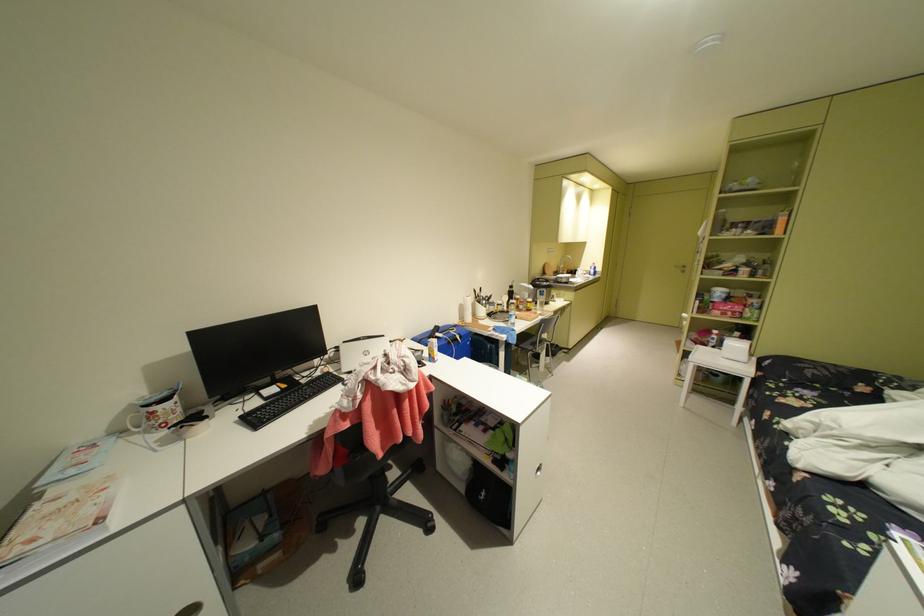
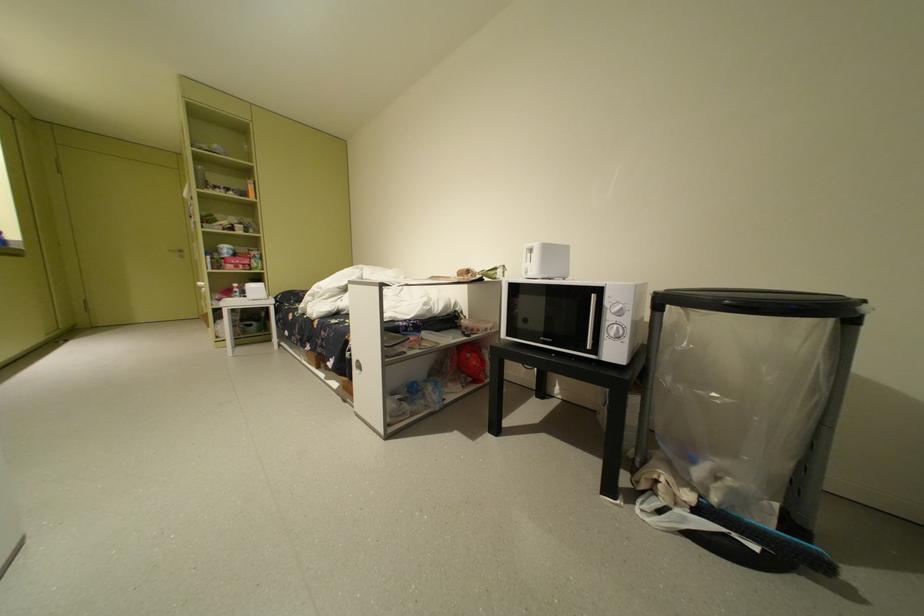
Question: The camera is either moving clockwise (left) or counter-clockwise (right) around the object. The first image is from the beginning of the video and the second image is from the end. Is the camera moving left or right when shooting the video?

Choices:
 (A) Left
 (B) Right

Answer: (A)